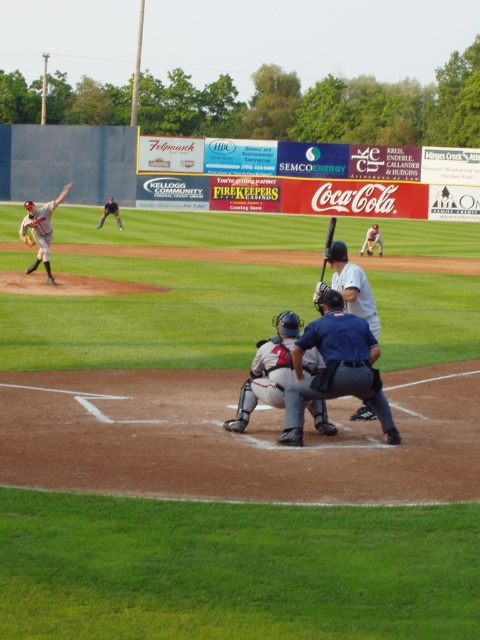
You are a new umpire at the baseball game. You need to determine if the two points marked on the field are in the correct positions for a specific play. According to the rules, the first point must be in front of the second point. Are the points point (x=360, y=250) and point (x=107, y=212) positioned correctly?

Point (x=360, y=250) is in front of point (x=107, y=212), so the points are positioned correctly according to the rule that the first point must be in front of the second point.

You are a spectator sitting in the stands and want to take a photo of both the black matte baseball bat at center and the brown leather glove at center. Which object will appear larger in your photo?

The black matte baseball bat at center will appear larger in the photo because it is closer to the viewer than the brown leather glove at center.

You are a coach observing a baseball game and need to quickly assess equipment sizes. Which object is wider between the black matte baseball bat at center and the brown leather glove at center?

The black matte baseball bat at center is wider than the brown leather glove at center.